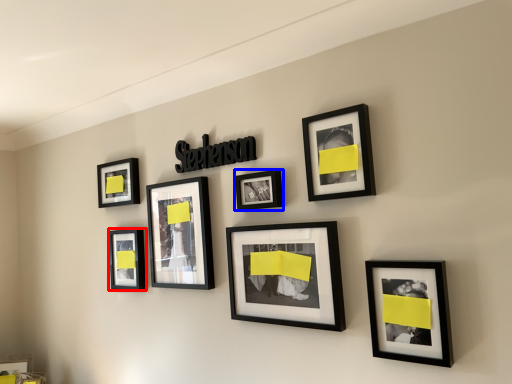
Question: Which point is further to the camera, picture frame (highlighted by a red box) or picture frame (highlighted by a blue box)?

Choices:
 (A) picture frame
 (B) picture frame

Answer: (A)